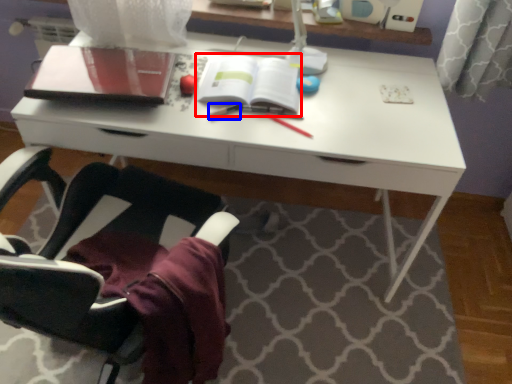
Question: Among these objects, which one is farthest to the camera, paperback book (highlighted by a red box) or stationery (highlighted by a blue box)?

Choices:
 (A) paperback book
 (B) stationery

Answer: (A)